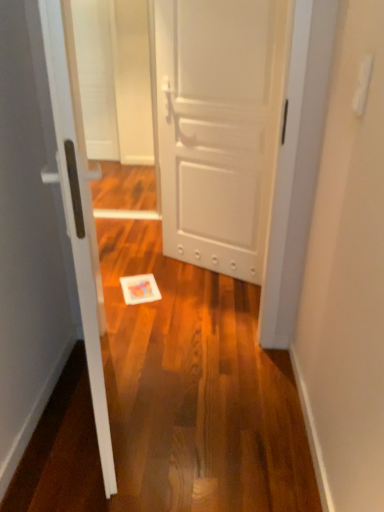
Question: From a real-world perspective, relative to white glossy door at center, acting as the second door starting from the right, is white matte door at center, positioned as the 1th door in back-to-front order, vertically above or below?

Choices:
 (A) below
 (B) above

Answer: (B)

Question: From their relative heights in the image, would you say white matte door at center, the 2th door in the left-to-right sequence, is taller or shorter than white glossy door at center, the second door from the back?

Choices:
 (A) short
 (B) tall

Answer: (B)

Question: From the image's perspective, is white matte door at center, the 2th door in the left-to-right sequence, located above or below white glossy door at center, acting as the second door starting from the right?

Choices:
 (A) above
 (B) below

Answer: (A)

Question: Considering the positions of white glossy door at center, the second door from the back, and white matte door at center, the 2th door in the left-to-right sequence, in the image, is white glossy door at center, the second door from the back, taller or shorter than white matte door at center, the 2th door in the left-to-right sequence,?

Choices:
 (A) short
 (B) tall

Answer: (A)

Question: Would you say white glossy door at center, the second door from the back, is to the left or to the right of white matte door at center, which appears as the second door when viewed from the front, in the picture?

Choices:
 (A) right
 (B) left

Answer: (B)

Question: Is point (21, 315) positioned closer to the camera than point (240, 78)?

Choices:
 (A) farther
 (B) closer

Answer: (B)

Question: Considering the positions of white glossy door at center, marked as the 1th door in a front-to-back arrangement, and white matte door at center, which appears as the second door when viewed from the front, in the image, is white glossy door at center, marked as the 1th door in a front-to-back arrangement, wider or thinner than white matte door at center, which appears as the second door when viewed from the front,?

Choices:
 (A) wide
 (B) thin

Answer: (A)